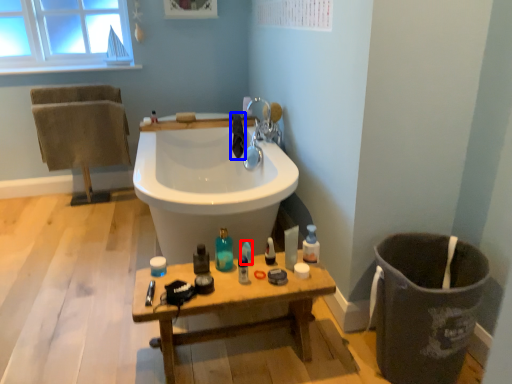
Question: Which point is further to the camera, cleaning product (highlighted by a red box) or bath towel (highlighted by a blue box)?

Choices:
 (A) cleaning product
 (B) bath towel

Answer: (B)